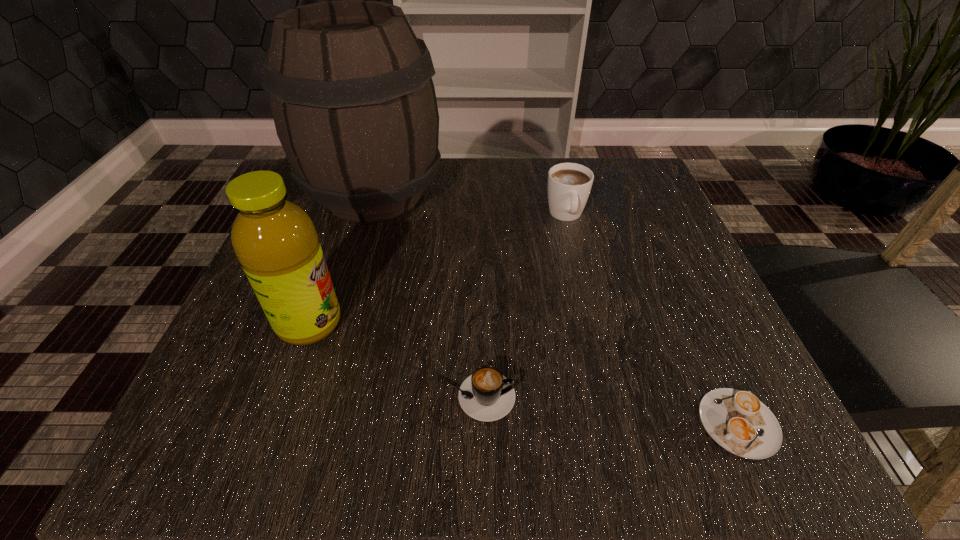
Where is `wine bucket`? This screenshot has width=960, height=540. wine bucket is located at coordinates (350, 85).

Identify the location of fruit juice. This screenshot has width=960, height=540. (275, 240).

This screenshot has width=960, height=540. In order to click on the fourth shortest object in this screenshot , I will do `click(275, 240)`.

Where is `the tallest cappuccino`? the tallest cappuccino is located at coordinates (569, 184).

Where is `the second cappuccino from right to left`? Image resolution: width=960 pixels, height=540 pixels. the second cappuccino from right to left is located at coordinates (569, 184).

I want to click on the third object from right to left, so click(486, 395).

You are a GUI agent. You are given a task and a screenshot of the screen. Output one action in this format:
    pyautogui.click(x=<x>, y=<y>)
    Task: Click on the fourth tallest object
    This screenshot has height=540, width=960.
    Given the screenshot: What is the action you would take?
    pyautogui.click(x=486, y=395)

At what (x,y) coordinates should I click in order to perform the action: click on the rightmost cappuccino. Please return your answer as a coordinate pair (x, y). This screenshot has width=960, height=540. Looking at the image, I should click on (738, 421).

Where is `the shortest cappuccino`? This screenshot has height=540, width=960. the shortest cappuccino is located at coordinates (738, 421).

Identify the location of vacant space situated on the right of the tallest object. (505, 193).